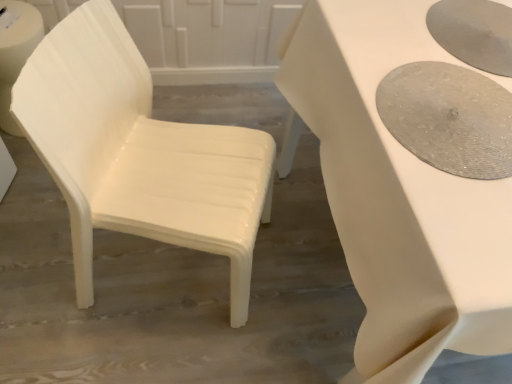
Locate an element on the screen. The image size is (512, 384). matte silver tray at right is located at coordinates (449, 118).

Image resolution: width=512 pixels, height=384 pixels. I want to click on white plastic chair at left, so click(138, 153).

Locate an element on the screen. matte silver tray at right is located at coordinates (449, 118).

From the picture: Who is taller, matte silver tray at right or white glossy table at center?

With more height is white glossy table at center.

From the picture: From a real-world perspective, which is physically below, matte silver tray at right or white glossy table at center?

From a 3D spatial view, white glossy table at center is below.

Is matte silver tray at right turned away from white glossy table at center?

Yes, matte silver tray at right is positioned with its back facing white glossy table at center.

Is matte silver tray at right to the left of white glossy table at center from the viewer's perspective?

Indeed, matte silver tray at right is positioned on the left side of white glossy table at center.

From a real-world perspective, which object rests below the other?

From a 3D spatial view, white plastic chair at left is below.

Looking at their sizes, would you say white plastic chair at left is wider or thinner than matte silver tray at right?

In the image, white plastic chair at left appears to be wider than matte silver tray at right.

Is point (138, 67) farther from viewer compared to point (403, 107)?

That is True.

Find the location of a particular element. The image size is (512, 384). chair in front of the matte silver tray at right is located at coordinates (138, 153).

From the image's perspective, between white plastic chair at left and white glossy table at center, who is located below?

white plastic chair at left is shown below in the image.

Where is `chair lying below the white glossy table at center (from the image's perspective)`? The height and width of the screenshot is (384, 512). chair lying below the white glossy table at center (from the image's perspective) is located at coordinates (138, 153).

In terms of size, does white plastic chair at left appear bigger or smaller than white glossy table at center?

In the image, white plastic chair at left appears to be smaller than white glossy table at center.

In the scene shown: Is white glossy table at center at the back of white plastic chair at left?

→ No.

Could you tell me if white glossy table at center is turned towards matte silver tray at right?

No.

Measure the distance from white glossy table at center to matte silver tray at right.

white glossy table at center and matte silver tray at right are 14.56 centimeters apart from each other.

The image size is (512, 384). Find the location of `oval behind the white glossy table at center`. oval behind the white glossy table at center is located at coordinates (449, 118).

Are white glossy table at center and matte silver tray at right making contact?

No, white glossy table at center is not next to matte silver tray at right.

Would you say white glossy table at center is a long distance from white plastic chair at left?

That's not correct — white glossy table at center is a little close to white plastic chair at left.

Visually, is white glossy table at center positioned to the left or to the right of white plastic chair at left?

Based on their positions, white glossy table at center is located to the right of white plastic chair at left.

Is point (340, 63) closer to camera compared to point (207, 204)?

Yes, point (340, 63) is in front of point (207, 204).

What's the angular difference between white glossy table at center and white plastic chair at left's facing directions?

The angle between the facing direction of white glossy table at center and the facing direction of white plastic chair at left is 69.4 degrees.

Is matte silver tray at right bigger or smaller than white plastic chair at left?

Considering their sizes, matte silver tray at right takes up less space than white plastic chair at left.

Does matte silver tray at right come behind white plastic chair at left?

Yes, matte silver tray at right is further from the viewer.

At what (x,y) coordinates should I click in order to perform the action: click on oval above the white plastic chair at left (from a real-world perspective). Please return your answer as a coordinate pair (x, y). This screenshot has width=512, height=384. Looking at the image, I should click on (449, 118).

Find the location of `table below the matte silver tray at right (from the image's perspective)`. table below the matte silver tray at right (from the image's perspective) is located at coordinates (398, 196).

Where is `chair in front of the matte silver tray at right`? The width and height of the screenshot is (512, 384). chair in front of the matte silver tray at right is located at coordinates [138, 153].

Considering their positions, is matte silver tray at right positioned further to white plastic chair at left than white glossy table at center?

matte silver tray at right is positioned further to the anchor white plastic chair at left.

Considering their positions, is white glossy table at center positioned further to matte silver tray at right than white plastic chair at left?

white plastic chair at left lies further to matte silver tray at right than the other object.

Based on their spatial positions, is white glossy table at center or matte silver tray at right further from white plastic chair at left?

Among the two, matte silver tray at right is located further to white plastic chair at left.

Estimate the real-world distances between objects in this image. Which object is closer to white glossy table at center, white plastic chair at left or matte silver tray at right?

The object closer to white glossy table at center is matte silver tray at right.

Based on their spatial positions, is matte silver tray at right or white plastic chair at left closer to white glossy table at center?

Among the two, matte silver tray at right is located nearer to white glossy table at center.

When comparing their distances from matte silver tray at right, does white plastic chair at left or white glossy table at center seem closer?

The object closer to matte silver tray at right is white glossy table at center.

The height and width of the screenshot is (384, 512). In order to click on oval located between white plastic chair at left and white glossy table at center in the left-right direction in this screenshot , I will do `click(449, 118)`.